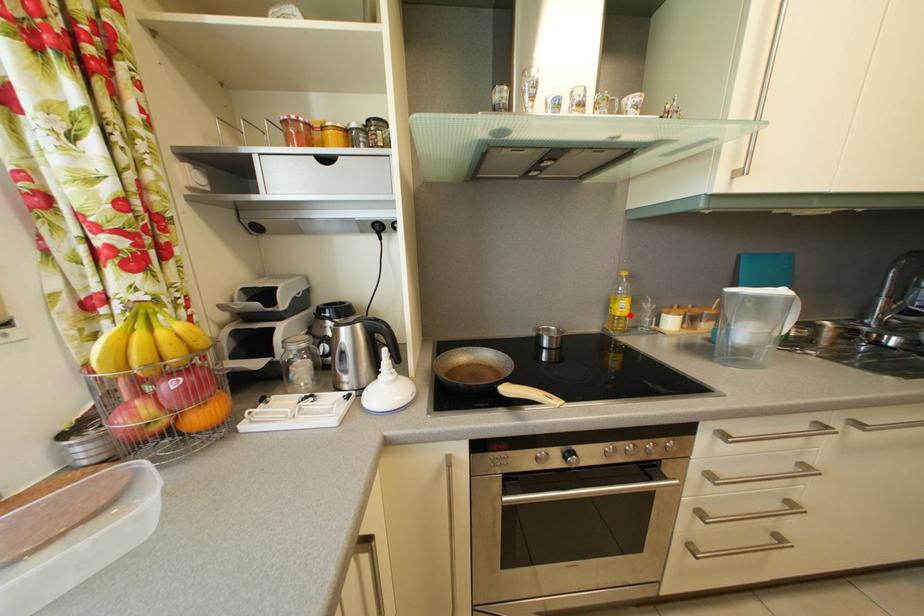
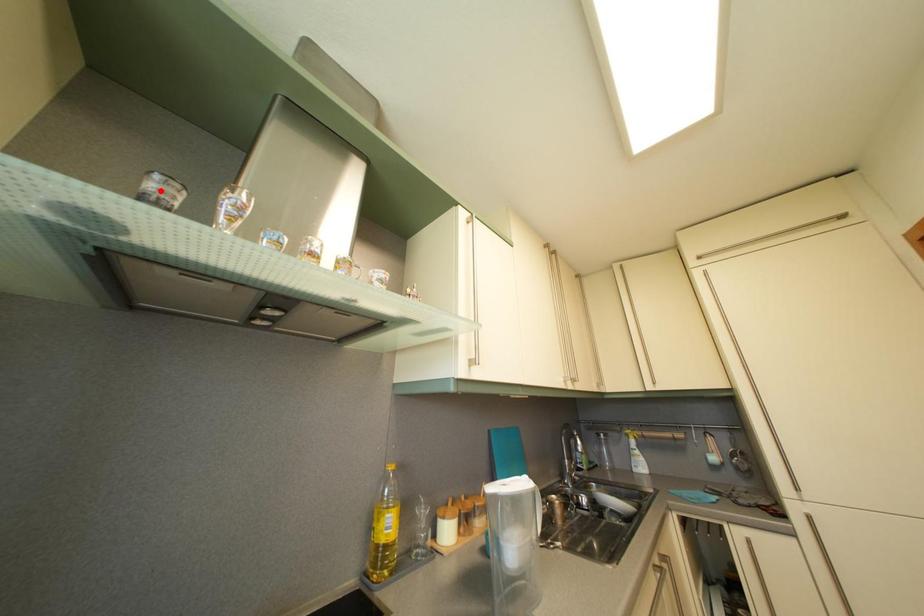
I am providing you with two images of the same scene from different viewpoints. A red point is marked on the first image and another point is marked on the second image. Is the red point in image1 aligned with the point shown in image2?

No